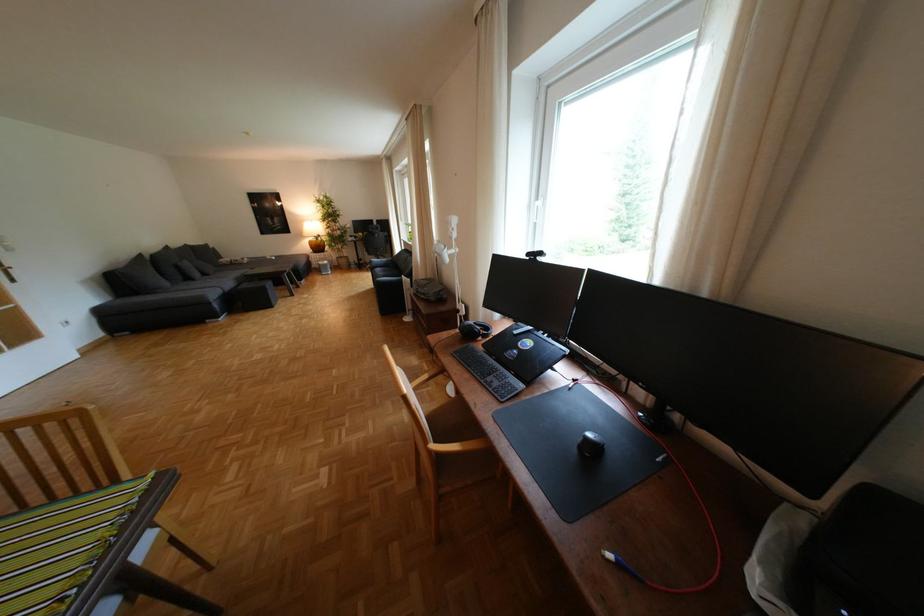
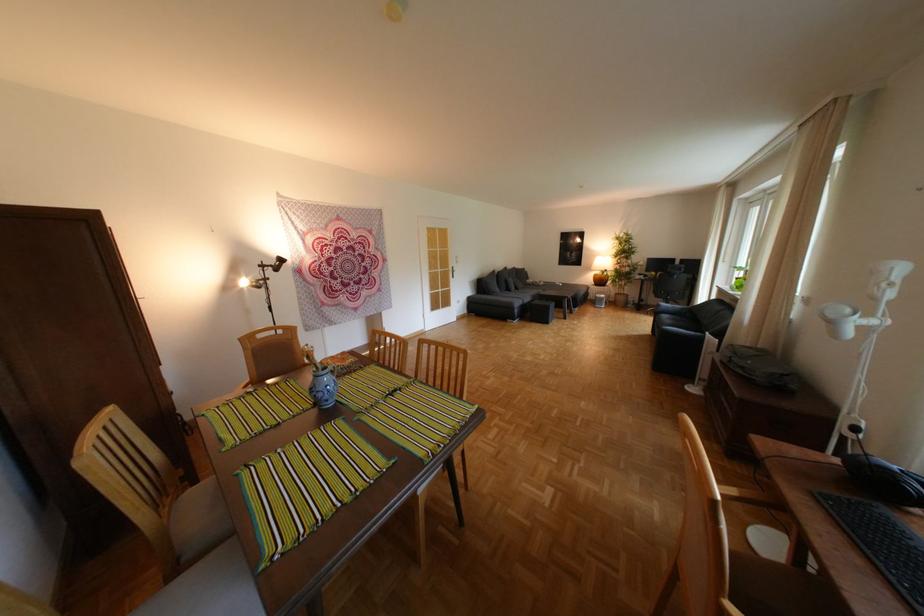
The point at (313,235) is marked in the first image. Where is the corresponding point in the second image?

(602, 268)